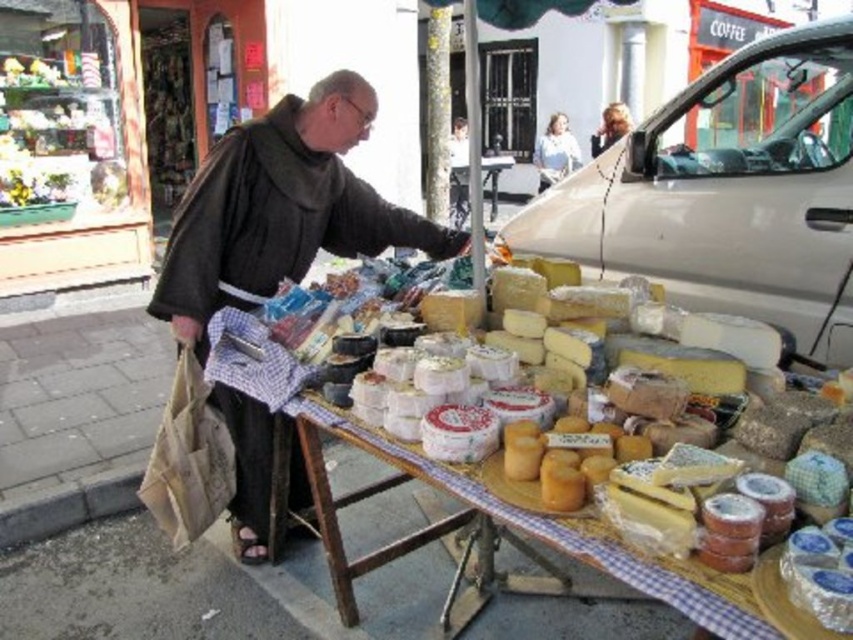
Question: Is dark brown woolen robe at center positioned at the back of wooden table at center?

Choices:
 (A) no
 (B) yes

Answer: (A)

Question: Which object appears closest to the camera in this image?

Choices:
 (A) dark brown woolen robe at center
 (B) wooden table at center

Answer: (A)

Question: Which point is farther to the camera?

Choices:
 (A) pyautogui.click(x=228, y=189)
 (B) pyautogui.click(x=500, y=168)

Answer: (B)

Question: Does dark brown woolen robe at center appear over wooden table at center?

Choices:
 (A) no
 (B) yes

Answer: (A)

Question: In this image, where is dark brown woolen robe at center located relative to wooden table at center?

Choices:
 (A) below
 (B) above

Answer: (A)